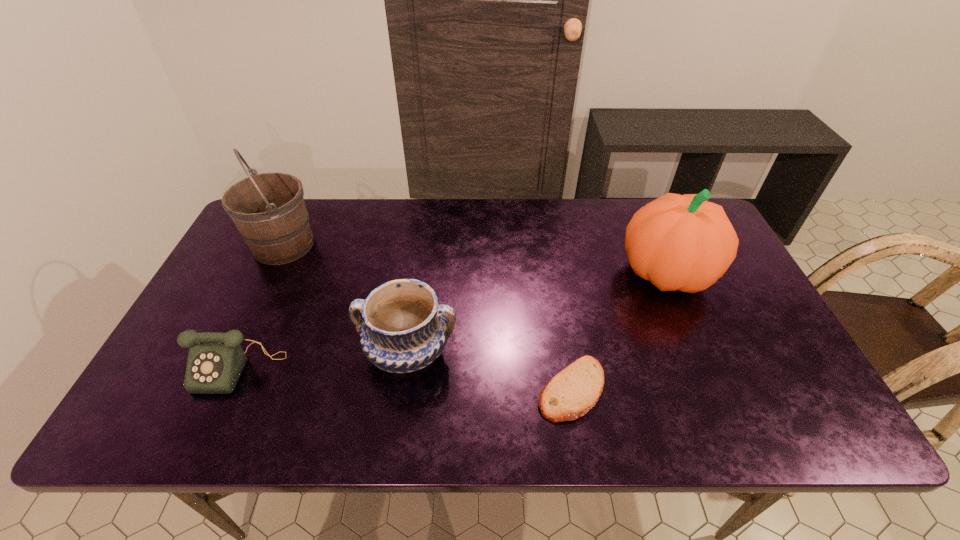
Image resolution: width=960 pixels, height=540 pixels. Find the location of `free space located on the dial of the fourth tallest object`. free space located on the dial of the fourth tallest object is located at coordinates (208, 433).

At what (x,y) coordinates should I click in order to perform the action: click on vacant area situated on the right of the second object from right to left. Please return your answer as a coordinate pair (x, y). This screenshot has height=540, width=960. Looking at the image, I should click on (641, 389).

The image size is (960, 540). What are the coordinates of `bucket present at the far edge` in the screenshot? It's located at (268, 209).

The width and height of the screenshot is (960, 540). What are the coordinates of `pumpkin located in the far edge section of the desktop` in the screenshot? It's located at (679, 242).

Identify the location of object that is at the near edge. (570, 394).

Where is `bucket positioned at the left edge`? bucket positioned at the left edge is located at coordinates (268, 209).

Where is `telephone at the left edge`? telephone at the left edge is located at coordinates (215, 361).

The image size is (960, 540). I want to click on object located in the right edge section of the desktop, so click(679, 242).

Image resolution: width=960 pixels, height=540 pixels. I want to click on object at the far left corner, so click(268, 209).

Locate an element on the screen. Image resolution: width=960 pixels, height=540 pixels. object at the far right corner is located at coordinates (679, 242).